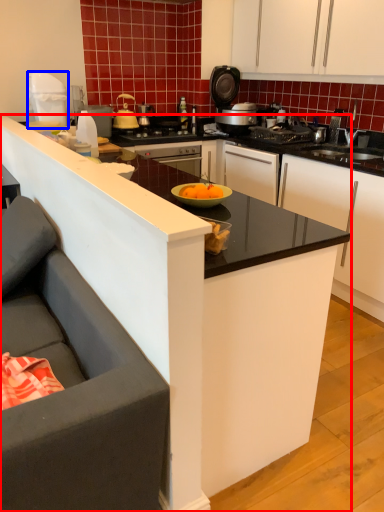
Question: Which of the following is the closest to the observer, countertop (highlighted by a red box) or kitchen appliance (highlighted by a blue box)?

Choices:
 (A) countertop
 (B) kitchen appliance

Answer: (A)